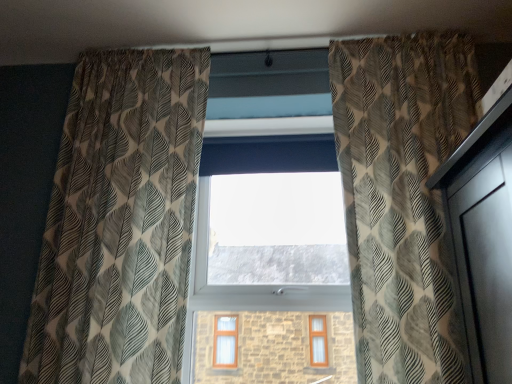
Question: Does printed fabric curtain at right, the 2th curtain positioned from the left, have a lesser height compared to textured beige curtain at left, which is the second curtain from right to left?

Choices:
 (A) yes
 (B) no

Answer: (A)

Question: Is printed fabric curtain at right, the 2th curtain positioned from the left, to the left of textured beige curtain at left, which is the first curtain in left-to-right order, from the viewer's perspective?

Choices:
 (A) yes
 (B) no

Answer: (B)

Question: From the image's perspective, does printed fabric curtain at right, the 2th curtain positioned from the left, appear higher than textured beige curtain at left, which is the second curtain from right to left?

Choices:
 (A) no
 (B) yes

Answer: (B)

Question: Is printed fabric curtain at right, placed as the 1th curtain when sorted from right to left, positioned with its back to textured beige curtain at left, which is the second curtain from right to left?

Choices:
 (A) no
 (B) yes

Answer: (A)

Question: Could textured beige curtain at left, which is the first curtain in left-to-right order, be considered to be inside printed fabric curtain at right, placed as the 1th curtain when sorted from right to left?

Choices:
 (A) no
 (B) yes

Answer: (A)

Question: Is there a large distance between printed fabric curtain at right, placed as the 1th curtain when sorted from right to left, and textured beige curtain at left, which is the first curtain in left-to-right order?

Choices:
 (A) yes
 (B) no

Answer: (B)

Question: Is textured beige curtain at left, which is the first curtain in left-to-right order, bigger than printed fabric curtain at right, placed as the 1th curtain when sorted from right to left?

Choices:
 (A) yes
 (B) no

Answer: (B)

Question: Could printed fabric curtain at right, the 2th curtain positioned from the left, be considered to be inside textured beige curtain at left, which is the first curtain in left-to-right order?

Choices:
 (A) no
 (B) yes

Answer: (A)

Question: Considering the relative positions of textured beige curtain at left, which is the first curtain in left-to-right order, and printed fabric curtain at right, the 2th curtain positioned from the left, in the image provided, is textured beige curtain at left, which is the first curtain in left-to-right order, to the left of printed fabric curtain at right, the 2th curtain positioned from the left, from the viewer's perspective?

Choices:
 (A) no
 (B) yes

Answer: (B)

Question: Considering the relative sizes of textured beige curtain at left, which is the first curtain in left-to-right order, and printed fabric curtain at right, placed as the 1th curtain when sorted from right to left, in the image provided, is textured beige curtain at left, which is the first curtain in left-to-right order, thinner than printed fabric curtain at right, placed as the 1th curtain when sorted from right to left,?

Choices:
 (A) yes
 (B) no

Answer: (A)

Question: Could you tell me if textured beige curtain at left, which is the second curtain from right to left, is turned towards printed fabric curtain at right, placed as the 1th curtain when sorted from right to left?

Choices:
 (A) no
 (B) yes

Answer: (A)

Question: Is textured beige curtain at left, which is the first curtain in left-to-right order, next to printed fabric curtain at right, the 2th curtain positioned from the left?

Choices:
 (A) yes
 (B) no

Answer: (B)

Question: Is transparent glass window at center wider than textured beige curtain at left, which is the second curtain from right to left?

Choices:
 (A) yes
 (B) no

Answer: (B)